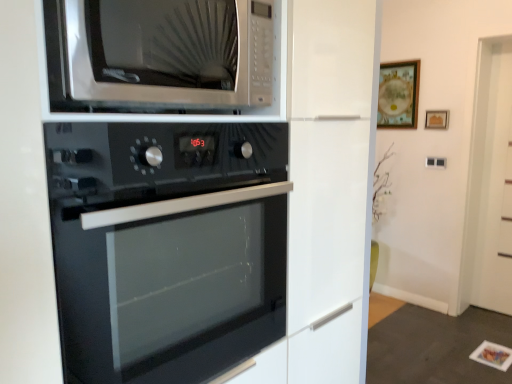
Question: Is black glass oven at center spatially inside satin silver microwave at upper center, or outside of it?

Choices:
 (A) inside
 (B) outside

Answer: (B)

Question: From the image's perspective, is black glass oven at center located above or below satin silver microwave at upper center?

Choices:
 (A) above
 (B) below

Answer: (B)

Question: Which of these objects is positioned closest to the white glossy door at right?

Choices:
 (A) wooden frame at upper center, acting as the second picture frame starting from the left
 (B) black glass oven at center
 (C) wooden framed picture at upper right, the 1th picture frame viewed from the left
 (D) satin silver microwave at upper center

Answer: (A)

Question: Which of these objects is positioned closest to the wooden frame at upper center, acting as the second picture frame starting from the left?

Choices:
 (A) white glossy door at right
 (B) satin silver microwave at upper center
 (C) black glass oven at center
 (D) wooden framed picture at upper right, the 2th picture frame when ordered from right to left

Answer: (D)